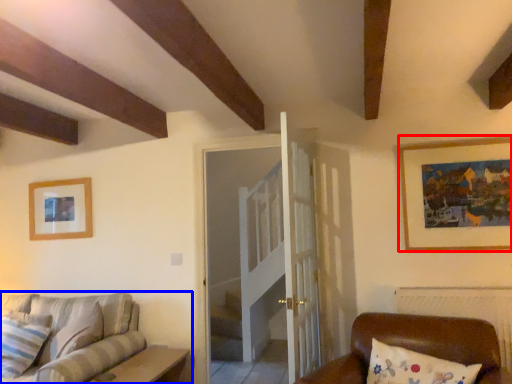
Question: Among these objects, which one is nearest to the camera, picture frame (highlighted by a red box) or studio couch (highlighted by a blue box)?

Choices:
 (A) picture frame
 (B) studio couch

Answer: (B)